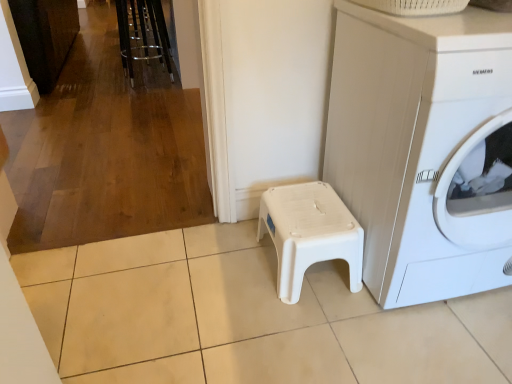
I want to click on vacant area in front of metallic chrome bar stool at upper left, so click(x=134, y=97).